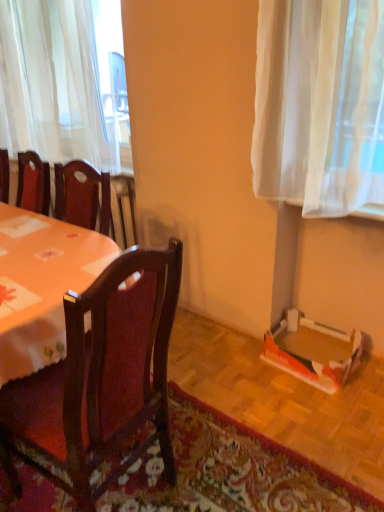
What do you see at coordinates (41, 285) in the screenshot? This screenshot has width=384, height=512. I see `wooden table at left` at bounding box center [41, 285].

Based on the photo, measure the distance between wooden table at left and camera.

wooden table at left and camera are 3.63 feet apart.

Identify the location of orange cardboard box at lower right. (313, 351).

Considering the sizes of objects white sheer curtain at upper left and floral carpet at lower right in the image provided, who is wider, white sheer curtain at upper left or floral carpet at lower right?

floral carpet at lower right.

Is white sheer curtain at upper left far away from floral carpet at lower right?

Yes, white sheer curtain at upper left is far from floral carpet at lower right.

The image size is (384, 512). What are the coordinates of `curtain on the left of floral carpet at lower right` in the screenshot? It's located at tap(53, 83).

Can you confirm if white sheer curtain at upper left is positioned to the right of floral carpet at lower right?

No.

Is floral carpet at lower right positioned beyond the bounds of orange cardboard box at lower right?

Absolutely, floral carpet at lower right is external to orange cardboard box at lower right.

Is floral carpet at lower right facing towards orange cardboard box at lower right?

No, floral carpet at lower right is not aimed at orange cardboard box at lower right.

Between point (185, 407) and point (288, 348), which one is positioned behind?

The point (288, 348) is more distant.

From a real-world perspective, is orange cardboard box at lower right physically below floral carpet at lower right?

No, from a real-world perspective, orange cardboard box at lower right is not beneath floral carpet at lower right.

Between orange cardboard box at lower right and floral carpet at lower right, which one has more height?

Standing taller between the two is orange cardboard box at lower right.

Is wooden table at left to the left of white sheer curtain at upper left from the viewer's perspective?

No.

Locate an element on the screen. desk below the white sheer curtain at upper left (from a real-world perspective) is located at coordinates (41, 285).

From the picture: From a real-world perspective, between wooden table at left and white sheer curtain at upper left, who is vertically higher?

From a 3D spatial view, white sheer curtain at upper left is above.

Which object is further away from the camera taking this photo, wooden table at left or white sheer curtain at upper left?

Positioned behind is white sheer curtain at upper left.

From the image's perspective, relative to wooden table at left, is orange cardboard box at lower right above or below?

orange cardboard box at lower right is situated lower than wooden table at left in the image.

Considering the points (325, 381) and (58, 228), which point is in front, point (325, 381) or point (58, 228)?

The point (58, 228) is in front.

Is orange cardboard box at lower right situated inside wooden table at left or outside?

orange cardboard box at lower right is not enclosed by wooden table at left.

From their relative heights in the image, would you say orange cardboard box at lower right is taller or shorter than wooden table at left?

Considering their sizes, orange cardboard box at lower right has less height than wooden table at left.

From the image's perspective, who appears lower, dark wood chair at center or white sheer curtain at upper left?

From the image's view, dark wood chair at center is below.

Is dark wood chair at center oriented away from white sheer curtain at upper left?

That's not correct — dark wood chair at center is not looking away from white sheer curtain at upper left.

From a real-world perspective, is dark wood chair at center over white sheer curtain at upper left?

No, from a real-world perspective, dark wood chair at center is not above white sheer curtain at upper left.

Does point (68, 460) come closer to viewer compared to point (95, 48)?

Yes, it is in front of point (95, 48).

From the image's perspective, is wooden table at left above or below floral carpet at lower right?

wooden table at left is situated higher than floral carpet at lower right in the image.

Considering the sizes of wooden table at left and floral carpet at lower right in the image, is wooden table at left bigger or smaller than floral carpet at lower right?

In the image, wooden table at left appears to be larger than floral carpet at lower right.

Is wooden table at left at the left side of floral carpet at lower right?

Yes.

In the scene shown: Can floral carpet at lower right be found inside wooden table at left?

No, floral carpet at lower right is not surrounded by wooden table at left.

At what (x,y) coordinates should I click in order to perform the action: click on mat beneath the white sheer curtain at upper left (from a real-world perspective). Please return your answer as a coordinate pair (x, y). This screenshot has height=512, width=384. Looking at the image, I should click on (229, 472).

Locate an element on the screen. The height and width of the screenshot is (512, 384). cardboard box behind the floral carpet at lower right is located at coordinates (313, 351).

Based on their spatial positions, is wooden table at left or orange cardboard box at lower right closer to floral carpet at lower right?

orange cardboard box at lower right.

Estimate the real-world distances between objects in this image. Which object is further from dark wood chair at center, white sheer curtain at upper left or orange cardboard box at lower right?

white sheer curtain at upper left is further to dark wood chair at center.

When comparing their distances from floral carpet at lower right, does wooden table at left or white sheer curtain at upper left seem further?

white sheer curtain at upper left.

Looking at the image, which one is located closer to orange cardboard box at lower right, floral carpet at lower right or white sheer curtain at upper left?

Based on the image, floral carpet at lower right appears to be nearer to orange cardboard box at lower right.

Which object lies nearer to the anchor point wooden table at left, dark wood chair at center or white sheer curtain at upper left?

Based on the image, dark wood chair at center appears to be nearer to wooden table at left.

Looking at the image, which one is located further to orange cardboard box at lower right, dark wood chair at center or floral carpet at lower right?

dark wood chair at center is further to orange cardboard box at lower right.

Estimate the real-world distances between objects in this image. Which object is closer to wooden table at left, white sheer curtain at upper left or floral carpet at lower right?

floral carpet at lower right is closer to wooden table at left.

Based on their spatial positions, is orange cardboard box at lower right or white sheer curtain at upper left closer to floral carpet at lower right?

The object closer to floral carpet at lower right is orange cardboard box at lower right.

Locate an element on the screen. desk between white sheer curtain at upper left and floral carpet at lower right in the up-down direction is located at coordinates (41, 285).

This screenshot has height=512, width=384. In order to click on chair between wooden table at left and floral carpet at lower right from top to bottom in this screenshot , I will do `click(100, 378)`.

Locate an element on the screen. The image size is (384, 512). mat located between wooden table at left and orange cardboard box at lower right in the left-right direction is located at coordinates (229, 472).

Locate an element on the screen. cardboard box between white sheer curtain at upper left and floral carpet at lower right in the vertical direction is located at coordinates (313, 351).